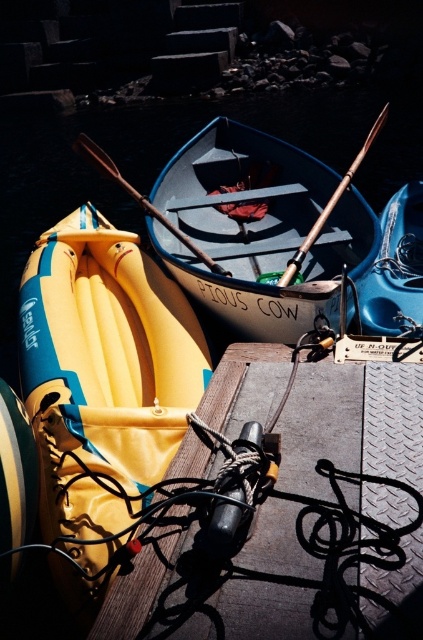
Who is more forward, [123,296] or [299,328]?

Point [299,328] is in front.

Is yellow fabric kayak at left above matte blue canoe at center?

No.

Is point (189, 365) farther from viewer compared to point (187, 157)?

No, it is in front of (187, 157).

Find the location of a particular element. yellow fabric kayak at left is located at coordinates (101, 385).

What do you see at coordinates (101, 385) in the screenshot? This screenshot has height=640, width=423. I see `yellow fabric kayak at left` at bounding box center [101, 385].

Measure the distance from yellow fabric kayak at left to wooden oar at center.

They are 3.72 feet apart.

Is point (49, 259) behind point (148, 212)?

No, it is not.

This screenshot has height=640, width=423. I want to click on yellow fabric kayak at left, so click(101, 385).

Is wooden oar at center above wooden polished paddle at center?

Correct, wooden oar at center is located above wooden polished paddle at center.

Is point (169, 220) farther from camera compared to point (351, 164)?

No, (169, 220) is in front of (351, 164).

I want to click on wooden oar at center, so click(139, 196).